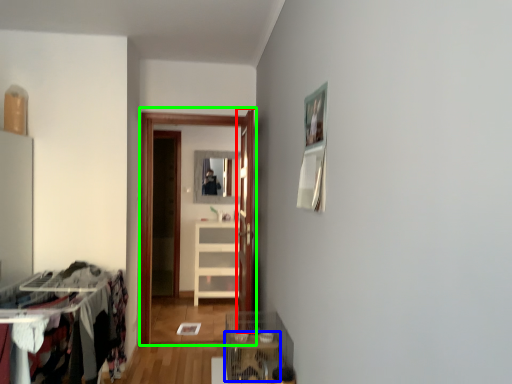
Question: Estimate the real-world distances between objects in this image. Which object is closer to door (highlighted by a red box), table (highlighted by a blue box) or glass door (highlighted by a green box)?

Choices:
 (A) table
 (B) glass door

Answer: (A)